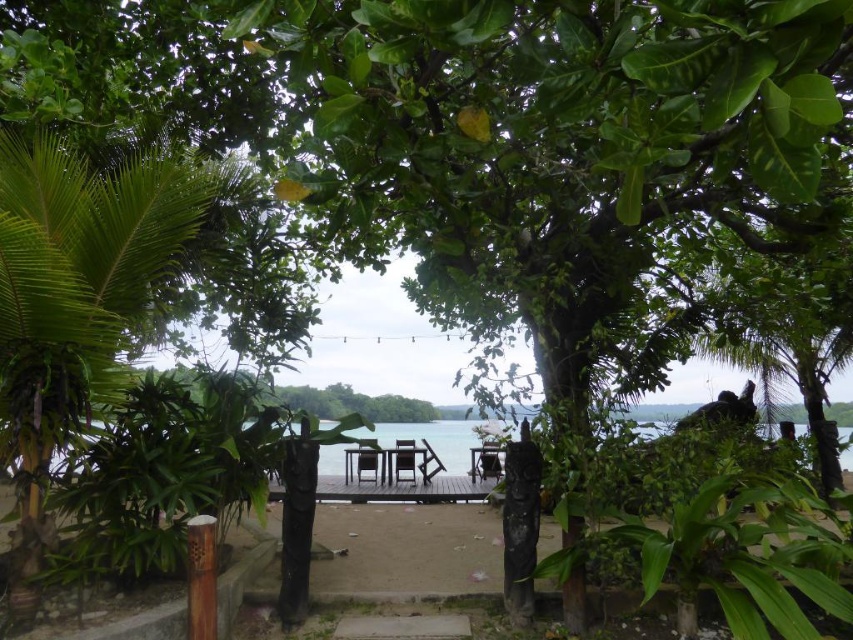
Can you confirm if dark brown wooden picnic table at center is taller than wooden picnic table at center?

Correct, dark brown wooden picnic table at center is much taller as wooden picnic table at center.

Is dark brown wooden picnic table at center to the right of wooden picnic table at center from the viewer's perspective?

Incorrect, dark brown wooden picnic table at center is not on the right side of wooden picnic table at center.

Find the location of a particular element. The image size is (853, 640). dark brown wooden picnic table at center is located at coordinates (390, 461).

At what (x,y) coordinates should I click in order to perform the action: click on dark brown wooden picnic table at center. Please return your answer as a coordinate pair (x, y). Looking at the image, I should click on coord(390,461).